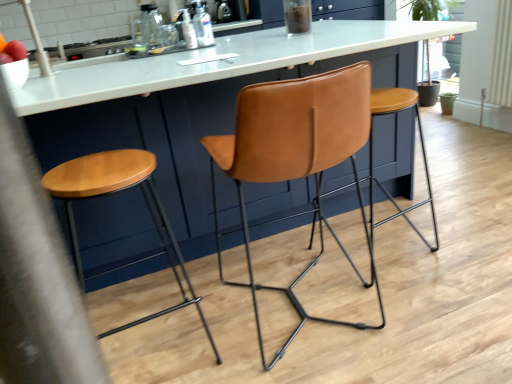
Identify the location of vacant area located to the right-hand side of cognac leather chair at center. tap(442, 291).